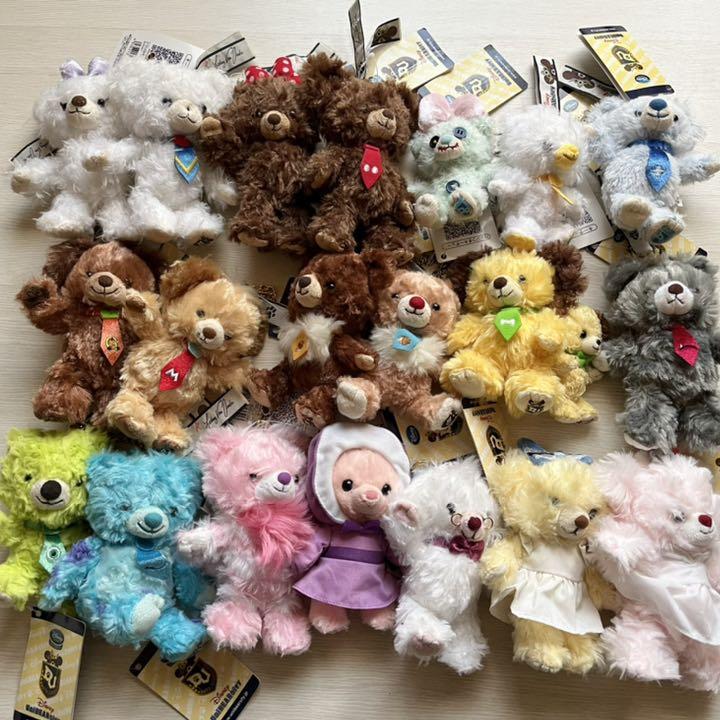
Where is `stuffed bears in the bottom row`? stuffed bears in the bottom row is located at coordinates (50, 518), (156, 531), (248, 534), (354, 526), (441, 544), (546, 544), (646, 554).